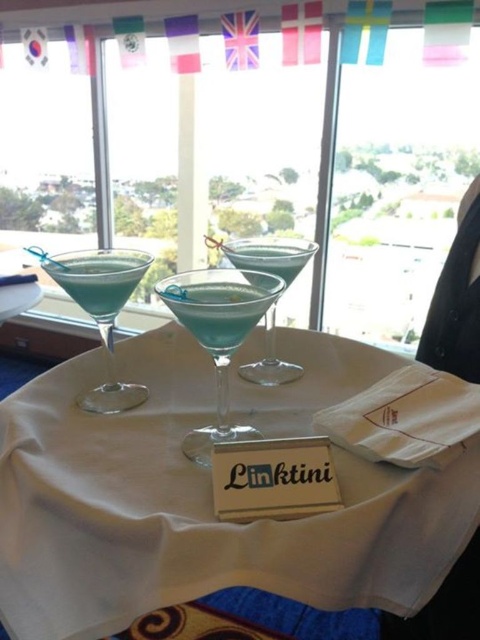
Is matte blue glass at left below blue glass at center?

Indeed, matte blue glass at left is positioned under blue glass at center.

Locate an element on the screen. This screenshot has width=480, height=640. matte blue glass at left is located at coordinates (101, 308).

Is blue glass at center further to camera compared to blue glass martini at center?

No.

Is point (212, 305) positioned in front of point (256, 262)?

Yes, it is in front of point (256, 262).

Is point (244, 326) positioned in front of point (277, 376)?

Yes, point (244, 326) is in front of point (277, 376).

At what (x,y) coordinates should I click in order to perform the action: click on blue glass at center. Please return your answer as a coordinate pair (x, y). The width and height of the screenshot is (480, 640). Looking at the image, I should click on (218, 305).

Between matte glass cocktail at center and matte blue glass at left, which one appears on the left side from the viewer's perspective?

matte blue glass at left is more to the left.

Who is positioned more to the right, matte glass cocktail at center or matte blue glass at left?

From the viewer's perspective, matte glass cocktail at center appears more on the right side.

Find the location of `matte glass cocktail at center`. matte glass cocktail at center is located at coordinates (218, 333).